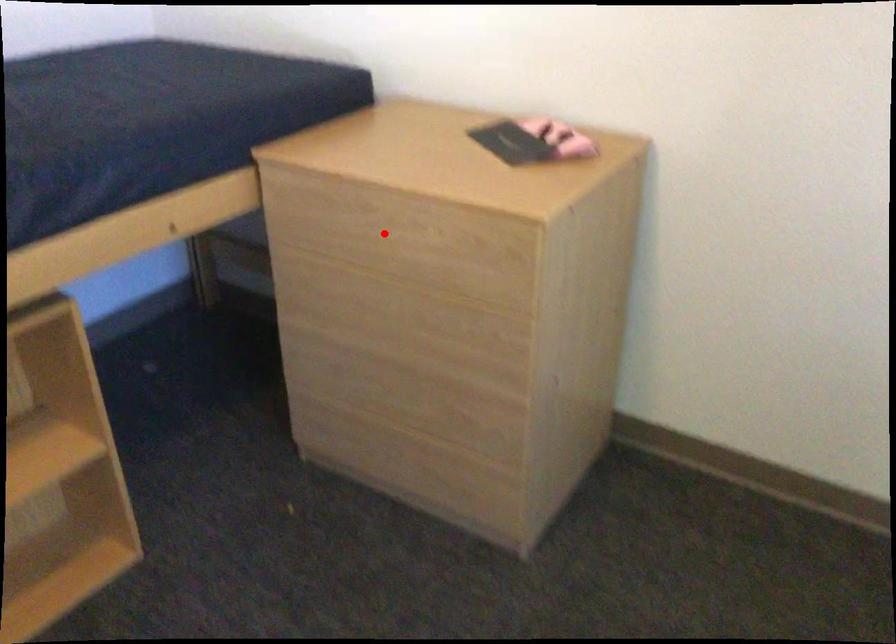
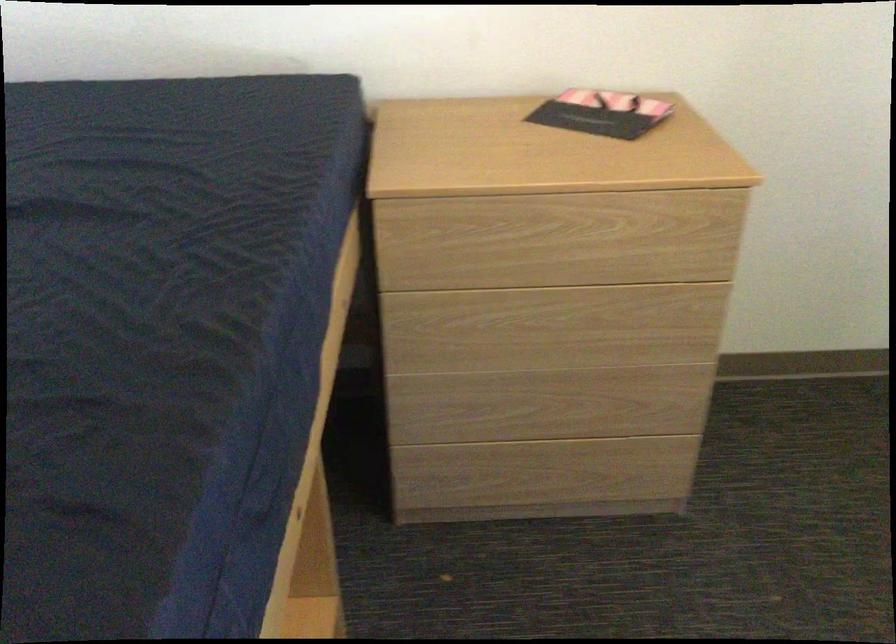
In the second image, find the point that corresponds to the highlighted location in the first image.

(557, 240)